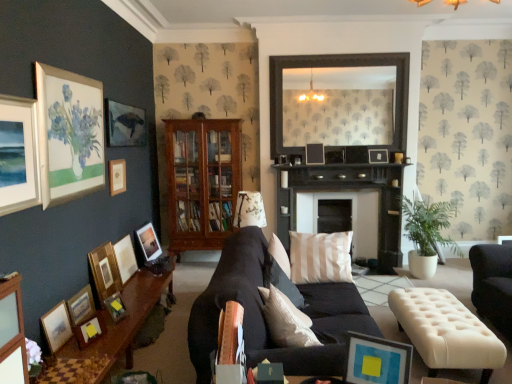
Question: Can you confirm if matte black picture frame at upper center, the 10th picture frame positioned from the left, is bigger than green leafy plant at right?

Choices:
 (A) no
 (B) yes

Answer: (A)

Question: From a real-world perspective, is matte black picture frame at upper center, which ranks as the fourth picture frame in right-to-left order, positioned under green leafy plant at right based on gravity?

Choices:
 (A) no
 (B) yes

Answer: (A)

Question: Is matte black picture frame at upper center, which ranks as the fourth picture frame in right-to-left order, facing away from green leafy plant at right?

Choices:
 (A) yes
 (B) no

Answer: (B)

Question: Does matte black picture frame at upper center, which ranks as the fourth picture frame in right-to-left order, have a greater width compared to green leafy plant at right?

Choices:
 (A) yes
 (B) no

Answer: (B)

Question: Does matte black picture frame at upper center, the 10th picture frame positioned from the left, have a lesser height compared to green leafy plant at right?

Choices:
 (A) no
 (B) yes

Answer: (B)

Question: Is matte black picture frame at upper center, which is the thirteenth picture frame from left to right, in front of or behind matte wooden picture frame at center, which is the seventh picture frame from right to left, in the image?

Choices:
 (A) behind
 (B) front

Answer: (A)

Question: Based on their sizes in the image, would you say matte black picture frame at upper center, which is the thirteenth picture frame from left to right, is bigger or smaller than matte wooden picture frame at center, which is the seventh picture frame from right to left?

Choices:
 (A) small
 (B) big

Answer: (A)

Question: From the image's perspective, is matte black picture frame at upper center, which is the thirteenth picture frame from left to right, positioned above or below matte wooden picture frame at center, which is the seventh picture frame from right to left?

Choices:
 (A) below
 (B) above

Answer: (B)

Question: Considering the positions of matte black picture frame at upper center, which is the thirteenth picture frame from left to right, and matte wooden picture frame at center, positioned as the seventh picture frame in left-to-right order, in the image, is matte black picture frame at upper center, which is the thirteenth picture frame from left to right, taller or shorter than matte wooden picture frame at center, positioned as the seventh picture frame in left-to-right order,?

Choices:
 (A) short
 (B) tall

Answer: (A)

Question: Is matte gold picture frame at lower left, the ninth picture frame positioned from the left, taller or shorter than mahogany wooden cabinet at center?

Choices:
 (A) short
 (B) tall

Answer: (A)

Question: Would you say matte gold picture frame at lower left, the 5th picture frame viewed from the right, is inside or outside mahogany wooden cabinet at center?

Choices:
 (A) inside
 (B) outside

Answer: (B)

Question: From the image's perspective, is matte gold picture frame at lower left, the 5th picture frame viewed from the right, positioned above or below mahogany wooden cabinet at center?

Choices:
 (A) below
 (B) above

Answer: (A)

Question: Considering the positions of matte gold picture frame at lower left, the ninth picture frame positioned from the left, and mahogany wooden cabinet at center in the image, is matte gold picture frame at lower left, the ninth picture frame positioned from the left, bigger or smaller than mahogany wooden cabinet at center?

Choices:
 (A) small
 (B) big

Answer: (A)

Question: Is wooden picture frame at lower left, acting as the 3th picture frame starting from the left, in front of or behind wooden picture frame at upper center, which appears as the 12th picture frame when viewed from the left, in the image?

Choices:
 (A) behind
 (B) front

Answer: (B)

Question: From a real-world perspective, is wooden picture frame at lower left, placed as the 11th picture frame when sorted from right to left, above or below wooden picture frame at upper center, which appears as the 12th picture frame when viewed from the left?

Choices:
 (A) below
 (B) above

Answer: (A)